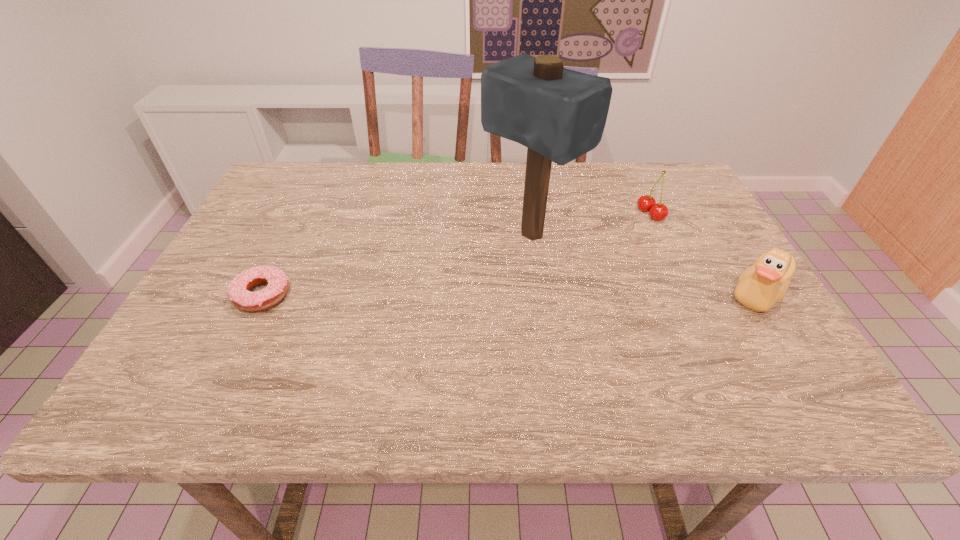
At what (x,y) coordinates should I click in order to perform the action: click on vacant space on the desktop that is between the doughnut and the duck and is positioned with the stems of the cherry pointing upwards. Please return your answer as a coordinate pair (x, y). Looking at the image, I should click on click(467, 294).

Locate an element on the screen. free spot on the desktop that is between the leftmost object and the rightmost object and is positioned on the striking surface of the tallest object is located at coordinates (443, 294).